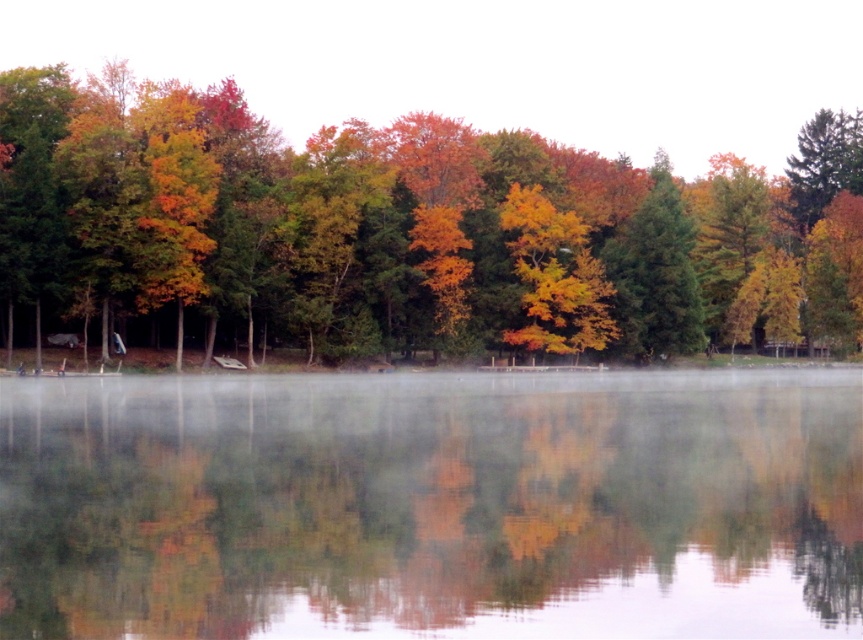
You are standing at the edge of the lake and see the point marked at coordinates (400,234). What is located at that point?

The point at coordinates (400,234) marks autumn leaves at center.